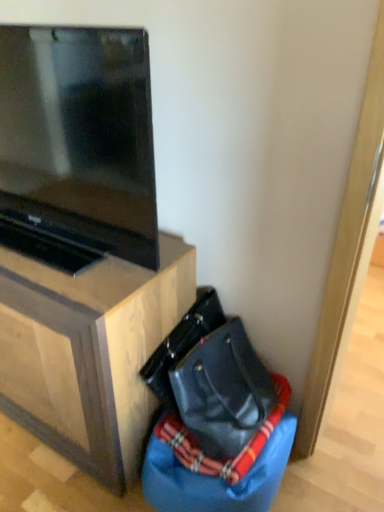
Question: Does black leather messenger bag at lower right have a larger size compared to matte black tv at upper left?

Choices:
 (A) no
 (B) yes

Answer: (A)

Question: From a real-world perspective, is black leather messenger bag at lower right located beneath matte black tv at upper left?

Choices:
 (A) yes
 (B) no

Answer: (A)

Question: Does black leather messenger bag at lower right turn towards matte black tv at upper left?

Choices:
 (A) yes
 (B) no

Answer: (B)

Question: Can you confirm if black leather messenger bag at lower right is smaller than matte black tv at upper left?

Choices:
 (A) yes
 (B) no

Answer: (A)

Question: Is black leather messenger bag at lower right looking in the opposite direction of matte black tv at upper left?

Choices:
 (A) no
 (B) yes

Answer: (A)

Question: Considering their positions, is blue fabric bean bag chair at lower right located in front of or behind matte black tv at upper left?

Choices:
 (A) behind
 (B) front

Answer: (A)

Question: In terms of height, does blue fabric bean bag chair at lower right look taller or shorter compared to matte black tv at upper left?

Choices:
 (A) tall
 (B) short

Answer: (B)

Question: Considering the positions of blue fabric bean bag chair at lower right and matte black tv at upper left in the image, is blue fabric bean bag chair at lower right bigger or smaller than matte black tv at upper left?

Choices:
 (A) small
 (B) big

Answer: (A)

Question: Considering the relative positions of blue fabric bean bag chair at lower right and matte black tv at upper left in the image provided, is blue fabric bean bag chair at lower right to the left or to the right of matte black tv at upper left?

Choices:
 (A) left
 (B) right

Answer: (B)

Question: Would you say matte black tv at upper left is to the left or to the right of black leather messenger bag at lower right in the picture?

Choices:
 (A) left
 (B) right

Answer: (A)

Question: Is point (124, 138) closer or farther from the camera than point (201, 300)?

Choices:
 (A) closer
 (B) farther

Answer: (A)

Question: Relative to black leather messenger bag at lower right, is matte black tv at upper left in front or behind?

Choices:
 (A) behind
 (B) front

Answer: (B)

Question: Considering the positions of matte black tv at upper left and black leather messenger bag at lower right in the image, is matte black tv at upper left wider or thinner than black leather messenger bag at lower right?

Choices:
 (A) wide
 (B) thin

Answer: (A)

Question: Is point (216, 306) closer or farther from the camera than point (44, 81)?

Choices:
 (A) closer
 (B) farther

Answer: (B)

Question: From a real-world perspective, is black leather messenger bag at lower right physically located above or below matte black tv at upper left?

Choices:
 (A) above
 (B) below

Answer: (B)